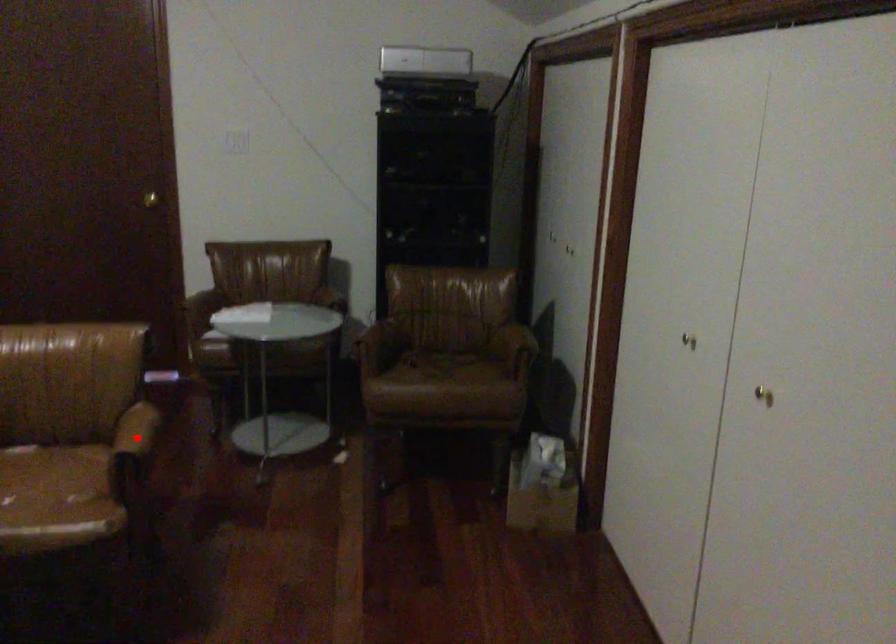
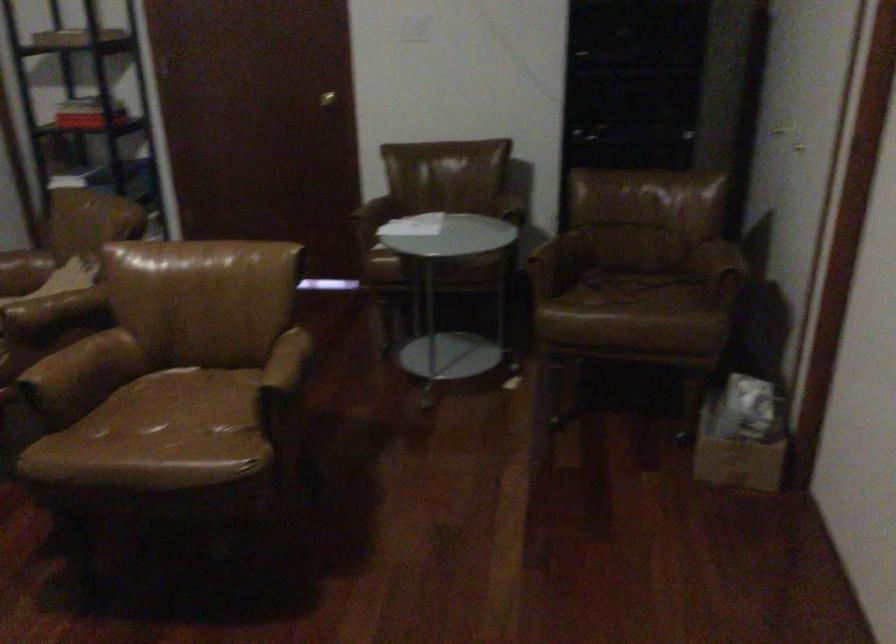
In the second image, find the point that corresponds to the highlighted location in the first image.

(283, 371)